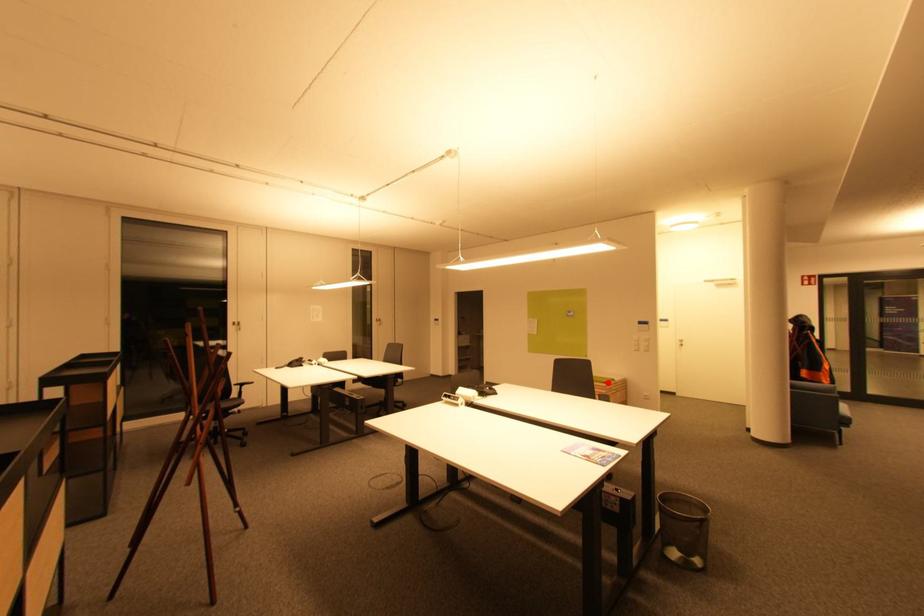
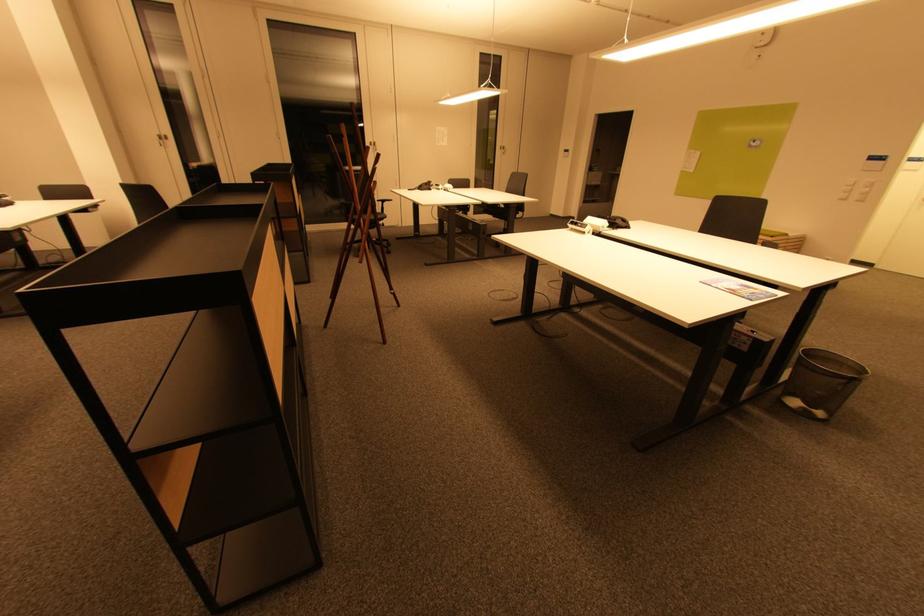
Locate, in the second image, the point that corresponds to the highlighted location in the first image.

(775, 236)